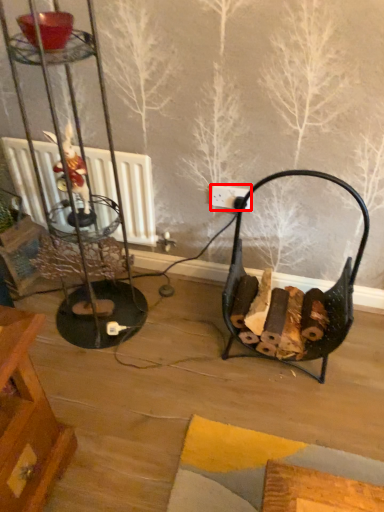
Question: Observing the image, what is the correct spatial positioning of electric outlet (annotated by the red box) in reference to armchair?

Choices:
 (A) right
 (B) left

Answer: (B)